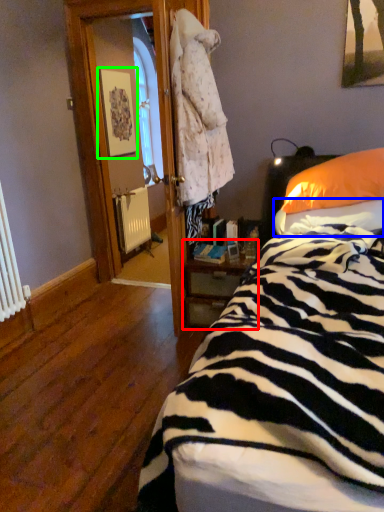
Question: Estimate the real-world distances between objects in this image. Which object is farther from nightstand (highlighted by a red box), sheet (highlighted by a blue box) or picture frame (highlighted by a green box)?

Choices:
 (A) sheet
 (B) picture frame

Answer: (B)